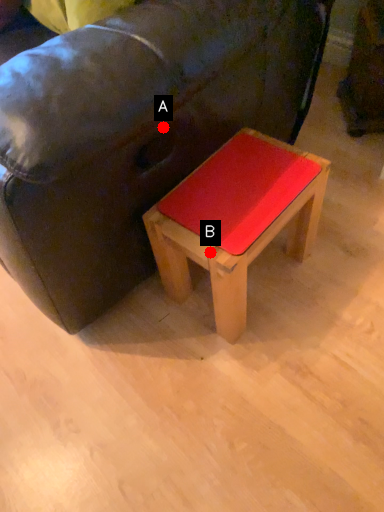
Question: Two points are circled on the image, labeled by A and B beside each circle. Which of the following is the closest to the observer?

Choices:
 (A) A is closer
 (B) B is closer

Answer: (A)